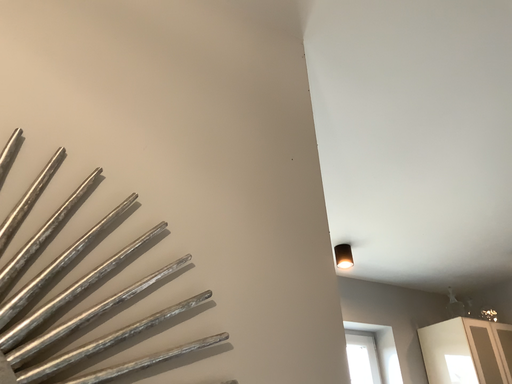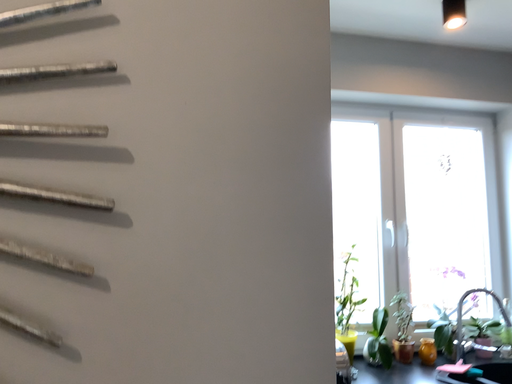
Question: Which way did the camera rotate in the video?

Choices:
 (A) rotated left
 (B) rotated right

Answer: (A)